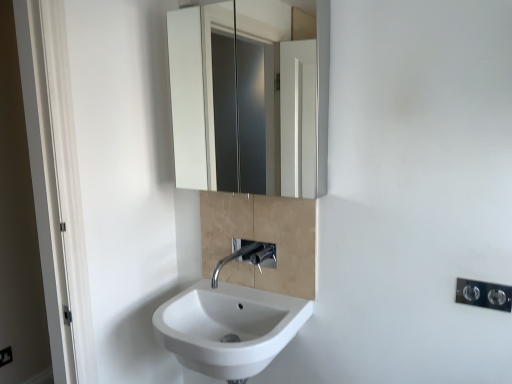
Describe the element at coordinates (247, 256) in the screenshot. I see `polished chrome faucet at center` at that location.

The width and height of the screenshot is (512, 384). What are the coordinates of `black plastic electric outlet at lower right` in the screenshot? It's located at (6, 356).

Is point (256, 304) closer to camera compared to point (263, 256)?

Yes, it is.

Is white glossy sink at lower center oriented towards polished chrome faucet at center?

No, white glossy sink at lower center is not oriented towards polished chrome faucet at center.

Looking at this image, considering the sizes of white glossy sink at lower center and polished chrome faucet at center in the image, is white glossy sink at lower center taller or shorter than polished chrome faucet at center?

white glossy sink at lower center is taller than polished chrome faucet at center.

Could you tell me if polished chrome faucet at center is turned towards white glossy sink at lower center?

No.

Considering the sizes of objects polished chrome faucet at center and white glossy sink at lower center in the image provided, who is shorter, polished chrome faucet at center or white glossy sink at lower center?

With less height is polished chrome faucet at center.

Is polished chrome faucet at center touching white glossy sink at lower center?

No, polished chrome faucet at center is not with white glossy sink at lower center.

Is point (253, 245) closer to camera compared to point (234, 373)?

That is False.

Considering the relative positions of white glossy cabinet at upper center and black plastic electric outlet at lower right in the image provided, is white glossy cabinet at upper center to the right of black plastic electric outlet at lower right from the viewer's perspective?

Indeed, white glossy cabinet at upper center is positioned on the right side of black plastic electric outlet at lower right.

Is white glossy cabinet at upper center facing towards black plastic electric outlet at lower right?

No, white glossy cabinet at upper center does not turn towards black plastic electric outlet at lower right.

Can you confirm if white glossy cabinet at upper center is smaller than black plastic electric outlet at lower right?

Actually, white glossy cabinet at upper center might be larger than black plastic electric outlet at lower right.

Does white glossy cabinet at upper center lie behind black plastic electric outlet at lower right?

That is False.

How far apart are polished chrome light switch at lower right and white glossy sink at lower center?

The distance of polished chrome light switch at lower right from white glossy sink at lower center is 30.28 inches.

From the image's perspective, between polished chrome light switch at lower right and white glossy sink at lower center, which one is located above?

polished chrome light switch at lower right, from the image's perspective.

What's the angular difference between polished chrome light switch at lower right and white glossy sink at lower center's facing directions?

They differ by 0.312 degrees in their facing directions.

Is polished chrome light switch at lower right wider than white glossy sink at lower center?

In fact, polished chrome light switch at lower right might be narrower than white glossy sink at lower center.

Between black plastic electric outlet at lower right and white glossy sink at lower center, which one has larger size?

white glossy sink at lower center.

In the image, is black plastic electric outlet at lower right on the left side or the right side of white glossy sink at lower center?

black plastic electric outlet at lower right is to the left of white glossy sink at lower center.

Would you say black plastic electric outlet at lower right is outside white glossy sink at lower center?

Yes, black plastic electric outlet at lower right is located beyond the bounds of white glossy sink at lower center.

I want to click on mirror on the right of black plastic electric outlet at lower right, so click(250, 98).

From the image's perspective, which object appears higher, black plastic electric outlet at lower right or white glossy cabinet at upper center?

white glossy cabinet at upper center is shown above in the image.

Which of these two, black plastic electric outlet at lower right or white glossy cabinet at upper center, stands taller?

white glossy cabinet at upper center is taller.

From the picture: Which is in front, black plastic electric outlet at lower right or white glossy cabinet at upper center?

Positioned in front is white glossy cabinet at upper center.

Which is more to the right, white glossy sink at lower center or white glossy cabinet at upper center?

white glossy cabinet at upper center.

Choose the correct answer: Is white glossy sink at lower center inside white glossy cabinet at upper center or outside it?

white glossy sink at lower center cannot be found inside white glossy cabinet at upper center.

From the image's perspective, which is below, white glossy sink at lower center or white glossy cabinet at upper center?

white glossy sink at lower center.

Is white glossy sink at lower center bigger or smaller than white glossy cabinet at upper center?

In the image, white glossy sink at lower center appears to be larger than white glossy cabinet at upper center.

Identify the location of tap behind the white glossy sink at lower center. This screenshot has height=384, width=512. (247, 256).

Locate an element on the screen. Image resolution: width=512 pixels, height=384 pixels. sink that is on the left side of polished chrome faucet at center is located at coordinates (230, 323).

Considering their positions, is polished chrome faucet at center positioned further to black plastic electric outlet at lower right than white glossy sink at lower center?

Based on the image, polished chrome faucet at center appears to be further to black plastic electric outlet at lower right.

Considering their positions, is polished chrome light switch at lower right positioned further to white glossy sink at lower center than white glossy cabinet at upper center?

white glossy cabinet at upper center is positioned further to the anchor white glossy sink at lower center.

Considering their positions, is polished chrome light switch at lower right positioned further to polished chrome faucet at center than black plastic electric outlet at lower right?

Among the two, black plastic electric outlet at lower right is located further to polished chrome faucet at center.

Considering their positions, is white glossy sink at lower center positioned closer to white glossy cabinet at upper center than polished chrome light switch at lower right?

Among the two, white glossy sink at lower center is located nearer to white glossy cabinet at upper center.

When comparing their distances from polished chrome faucet at center, does white glossy sink at lower center or polished chrome light switch at lower right seem closer?

The object closer to polished chrome faucet at center is white glossy sink at lower center.

Based on their spatial positions, is black plastic electric outlet at lower right or white glossy sink at lower center closer to white glossy cabinet at upper center?

white glossy sink at lower center lies closer to white glossy cabinet at upper center than the other object.

Based on their spatial positions, is white glossy sink at lower center or black plastic electric outlet at lower right closer to polished chrome light switch at lower right?

Based on the image, white glossy sink at lower center appears to be nearer to polished chrome light switch at lower right.

Considering their positions, is polished chrome faucet at center positioned further to polished chrome light switch at lower right than white glossy sink at lower center?

white glossy sink at lower center is further to polished chrome light switch at lower right.

This screenshot has width=512, height=384. I want to click on tap located between black plastic electric outlet at lower right and polished chrome light switch at lower right in the left-right direction, so click(247, 256).

This screenshot has height=384, width=512. In order to click on mirror located between black plastic electric outlet at lower right and polished chrome faucet at center in the left-right direction in this screenshot , I will do `click(250, 98)`.

Locate an element on the screen. This screenshot has height=384, width=512. tap between white glossy sink at lower center and polished chrome light switch at lower right from left to right is located at coordinates (247, 256).

Where is `sink situated between black plastic electric outlet at lower right and polished chrome faucet at center from left to right`? Image resolution: width=512 pixels, height=384 pixels. sink situated between black plastic electric outlet at lower right and polished chrome faucet at center from left to right is located at coordinates (230, 323).